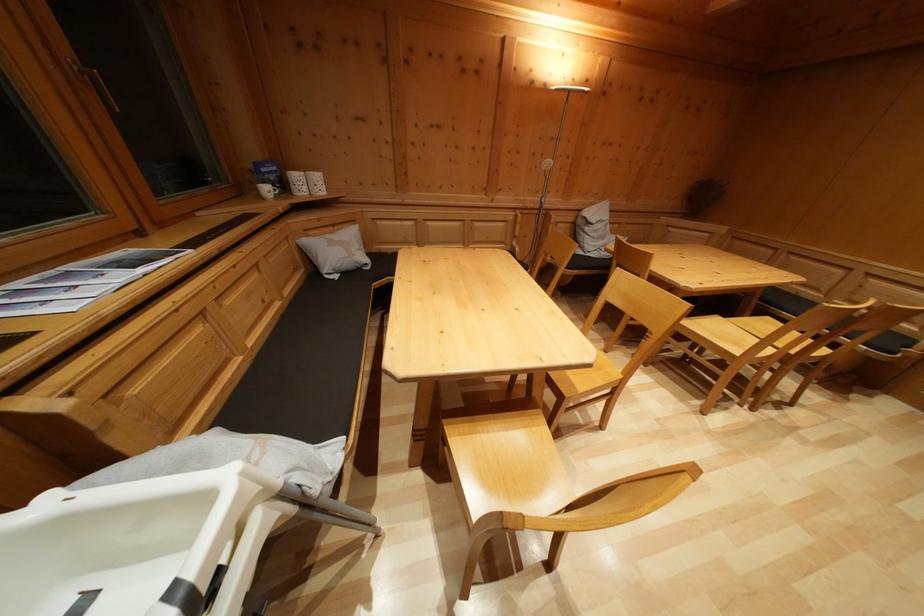
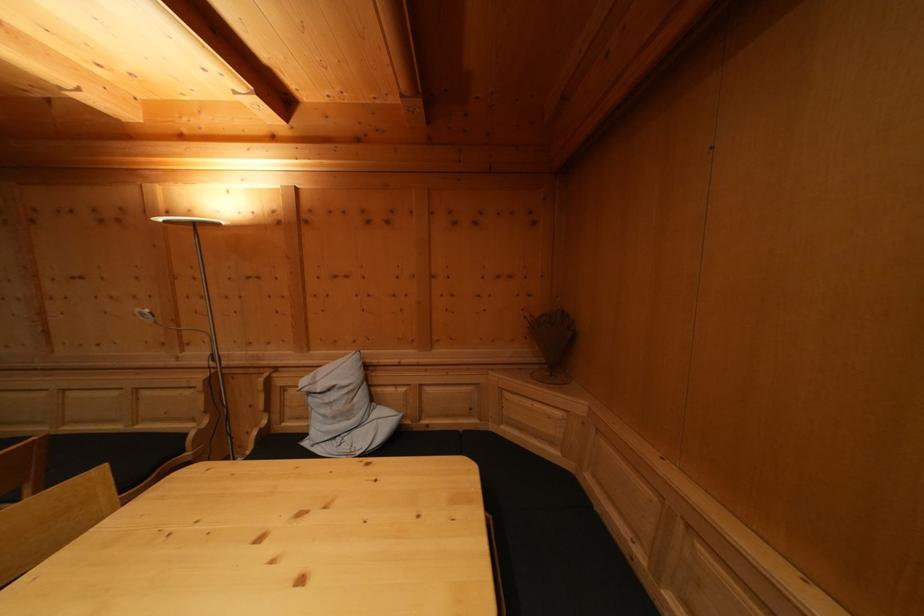
In a continuous first-person perspective shot, in which direction is the camera moving?

The cameraman moved toward right, forward.